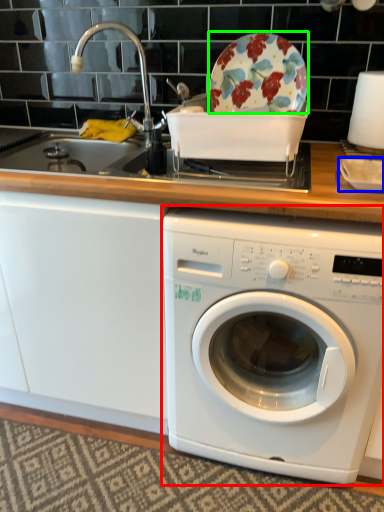
Question: Considering the real-world distances, which object is closest to washing machine (highlighted by a red box)? tableware (highlighted by a blue box) or table (highlighted by a green box).

Choices:
 (A) tableware
 (B) table

Answer: (A)